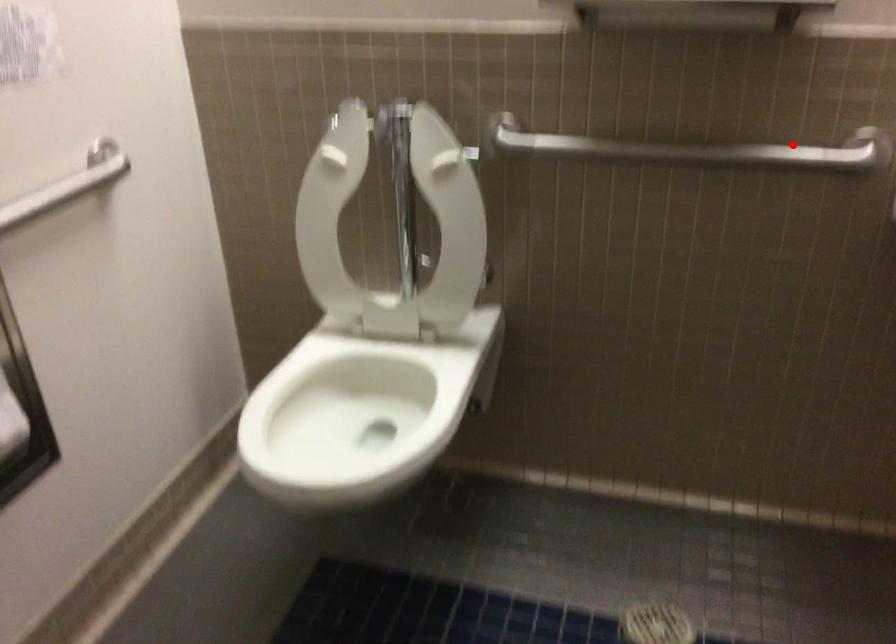
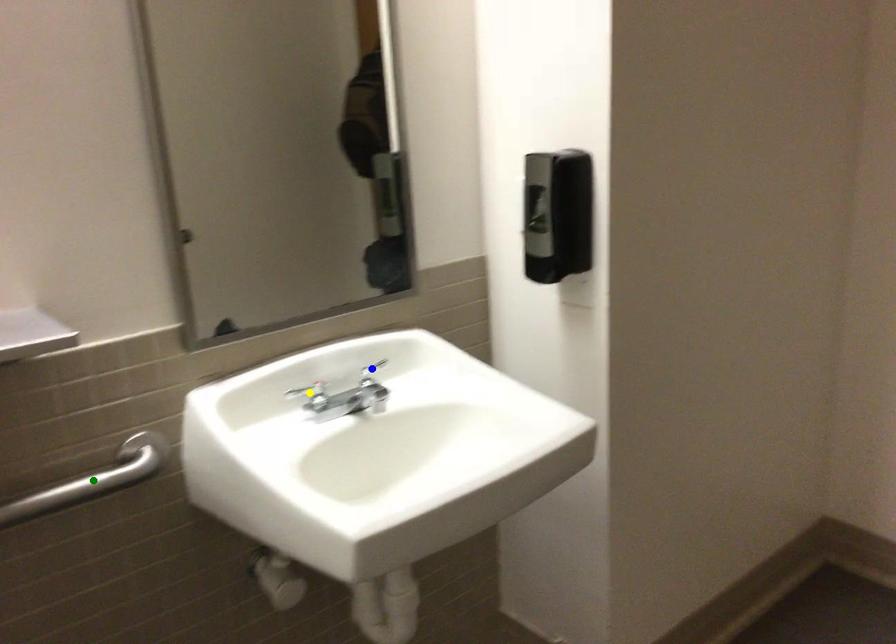
Question: I am providing you with two images of the same scene from different viewpoints. A red point is marked on the first image. You are given multiple points on the second image. Which point in image 2 represents the same 3d spot as the red point in image 1?

Choices:
 (A) yellow point
 (B) green point
 (C) blue point

Answer: (B)